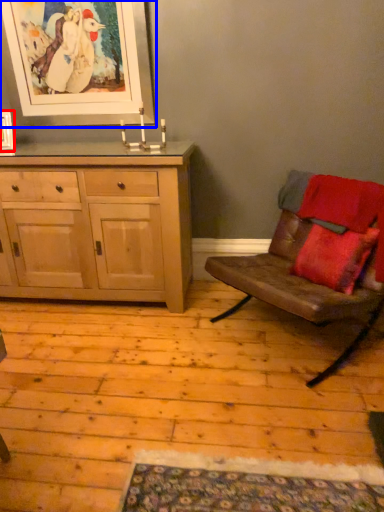
Question: Which object is closer to the camera taking this photo, picture frame (highlighted by a red box) or picture frame (highlighted by a blue box)?

Choices:
 (A) picture frame
 (B) picture frame

Answer: (B)